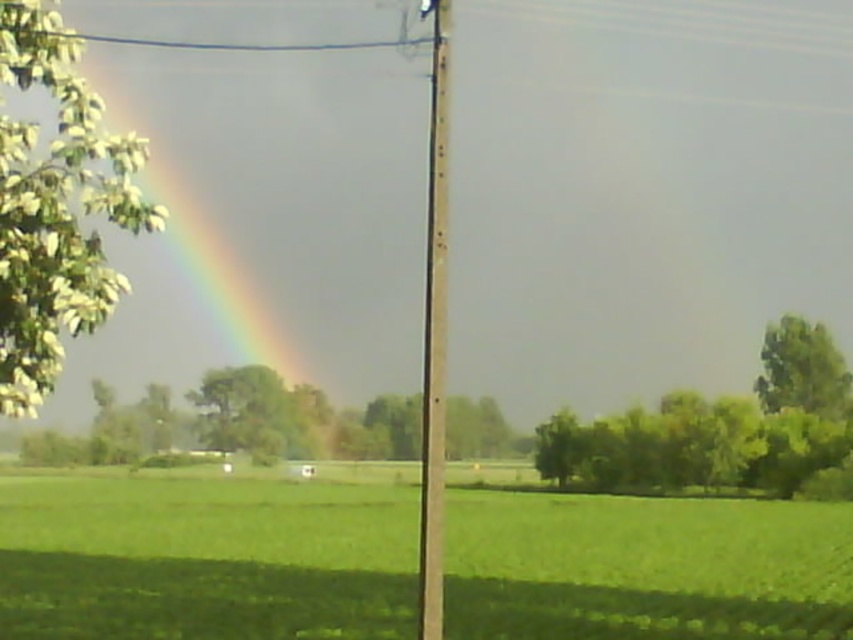
Question: Which of the following is the closest to the observer?

Choices:
 (A) (843, 595)
 (B) (437, 163)

Answer: (B)

Question: Is green leafy tree at center to the right of green leafy tree at right from the viewer's perspective?

Choices:
 (A) no
 (B) yes

Answer: (A)

Question: Is green grassy field at center above rainbow at upper left?

Choices:
 (A) no
 (B) yes

Answer: (A)

Question: Which object appears farthest from the camera in this image?

Choices:
 (A) green leafy tree at right
 (B) rainbow at upper left

Answer: (A)

Question: Which of the following is the closest to the observer?

Choices:
 (A) green leafy tree at left
 (B) green grassy field at center

Answer: (A)

Question: Can you confirm if green grassy field at center is thinner than green leafy tree at left?

Choices:
 (A) no
 (B) yes

Answer: (A)